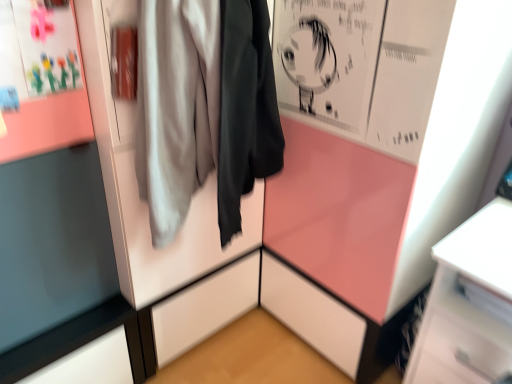
Question: From the image's perspective, would you say matte gray jacket at center is positioned over matte paper poster at upper left?

Choices:
 (A) yes
 (B) no

Answer: (B)

Question: From a real-world perspective, is matte gray jacket at center on top of matte paper poster at upper left?

Choices:
 (A) no
 (B) yes

Answer: (A)

Question: From a real-world perspective, is matte gray jacket at center positioned under matte paper poster at upper left based on gravity?

Choices:
 (A) yes
 (B) no

Answer: (A)

Question: Is matte gray jacket at center positioned with its back to matte paper poster at upper left?

Choices:
 (A) no
 (B) yes

Answer: (A)

Question: Considering the relative sizes of matte gray jacket at center and matte paper poster at upper left in the image provided, is matte gray jacket at center taller than matte paper poster at upper left?

Choices:
 (A) no
 (B) yes

Answer: (B)

Question: Considering the relative sizes of matte gray jacket at center and matte paper poster at upper left in the image provided, is matte gray jacket at center thinner than matte paper poster at upper left?

Choices:
 (A) no
 (B) yes

Answer: (A)

Question: Does matte paper poster at upper left have a lesser width compared to matte gray jacket at center?

Choices:
 (A) no
 (B) yes

Answer: (B)

Question: Considering the relative sizes of matte paper poster at upper left and matte gray jacket at center in the image provided, is matte paper poster at upper left shorter than matte gray jacket at center?

Choices:
 (A) no
 (B) yes

Answer: (B)

Question: Does matte paper poster at upper left appear on the left side of matte gray jacket at center?

Choices:
 (A) yes
 (B) no

Answer: (A)

Question: Is matte paper poster at upper left smaller than matte gray jacket at center?

Choices:
 (A) yes
 (B) no

Answer: (A)

Question: Would you consider matte paper poster at upper left to be distant from matte gray jacket at center?

Choices:
 (A) yes
 (B) no

Answer: (B)

Question: Is matte paper poster at upper left taller than matte gray jacket at center?

Choices:
 (A) no
 (B) yes

Answer: (A)

Question: Based on their sizes in the image, would you say matte paper poster at upper left is bigger or smaller than matte gray jacket at center?

Choices:
 (A) small
 (B) big

Answer: (A)